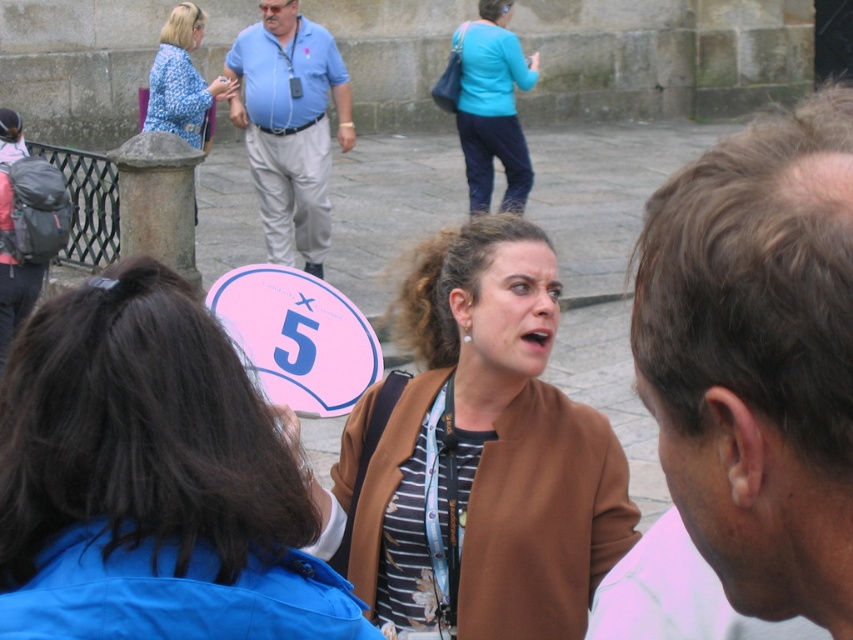
You are organizing a clothing display and need to arrange the blue shirt at center and the teal fabric top at upper center side by side. Based on their widths, which one should be placed on the left to ensure they fit within a 1.5 meter wide display area?

The blue shirt at center is wider than the teal fabric top at upper center. To fit within the 1.5 meter display area, place the wider blue shirt at center on the left and the narrower teal fabric top at upper center on the right, ensuring they align properly without overlapping.

You are standing at the center of the scene and want to hand a document to both the light brown hair at center and the blue shirt at center. Since you can only move forward in a straight line, will you be able to reach both without changing direction?

The light brown hair at center and blue shirt at center are 5.21 meters apart. Since you can only move forward in a straight line, you can reach both by continuing in the same direction as they are aligned along your path.